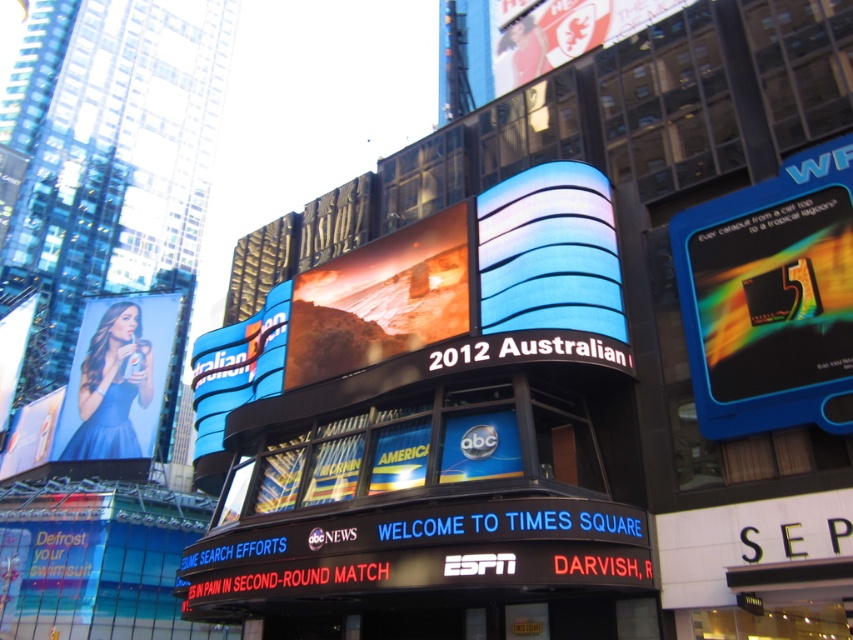
Question: Can you confirm if metallic blue card at upper right is positioned to the left of blue glossy dress at left?

Choices:
 (A) no
 (B) yes

Answer: (A)

Question: Can you confirm if matte glass billboard at center is thinner than blue glossy dress at left?

Choices:
 (A) yes
 (B) no

Answer: (A)

Question: Which point is closer to the camera?

Choices:
 (A) (407, 333)
 (B) (767, 324)

Answer: (B)

Question: Which object is positioned farthest from the matte glass billboard at center?

Choices:
 (A) blue glossy billboard at center
 (B) matte plastic billboard at upper left

Answer: (B)

Question: Which object is positioned closest to the blue glossy abc logo at center?

Choices:
 (A) metallic silver lion at upper center
 (B) blue glossy dress at left
 (C) matte glass billboard at center
 (D) metallic blue card at upper right

Answer: (C)

Question: Considering the relative positions of blue glossy billboard at center and blue glossy abc logo at center in the image provided, where is blue glossy billboard at center located with respect to blue glossy abc logo at center?

Choices:
 (A) below
 (B) above

Answer: (B)